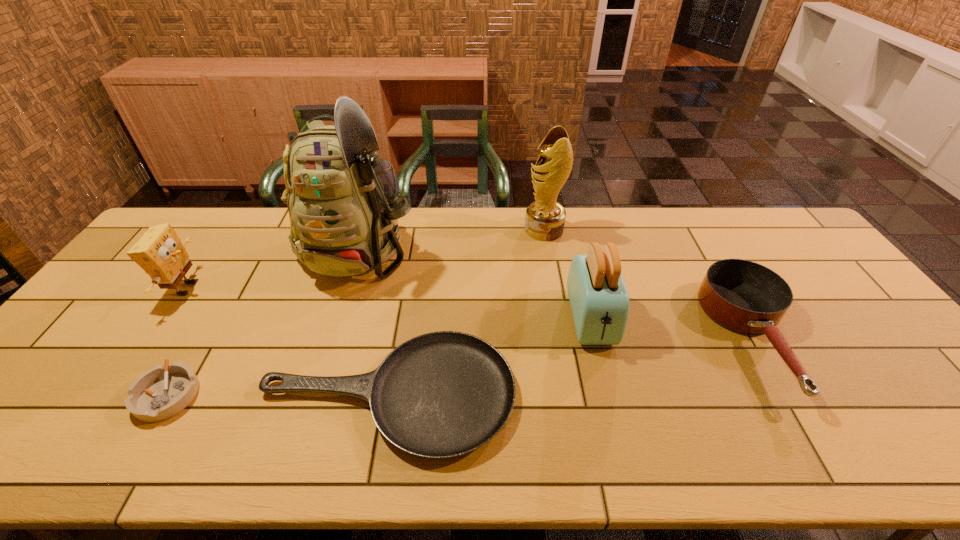
This screenshot has width=960, height=540. In order to click on free space located on the front-facing side of the backpack in this screenshot , I will do `click(336, 320)`.

The height and width of the screenshot is (540, 960). I want to click on free space located on the front-facing side of the sixth shortest object, so click(463, 230).

This screenshot has height=540, width=960. I want to click on vacant space located 0.200m on the front-facing side of the sixth shortest object, so click(x=467, y=230).

I want to click on free space located on the front-facing side of the sixth shortest object, so click(443, 230).

This screenshot has width=960, height=540. What are the coordinates of `free spot located on the side of the toaster with the lever` in the screenshot? It's located at (610, 393).

Where is `vacant space located 0.150m on the face of the fourth shortest object`? vacant space located 0.150m on the face of the fourth shortest object is located at coordinates (252, 289).

Find the location of a particular element. This screenshot has width=960, height=540. free space located 0.210m on the left of the sixth object from right to left is located at coordinates (49, 395).

At what (x,y) coordinates should I click in order to perform the action: click on free space located 0.290m on the back of the shortest object. Please return your answer as a coordinate pair (x, y). The height and width of the screenshot is (540, 960). Looking at the image, I should click on (410, 266).

At what (x,y) coordinates should I click in order to perform the action: click on backpack present at the far edge. Please return your answer as a coordinate pair (x, y). Looking at the image, I should click on (343, 204).

This screenshot has width=960, height=540. I want to click on award that is at the far edge, so click(x=545, y=218).